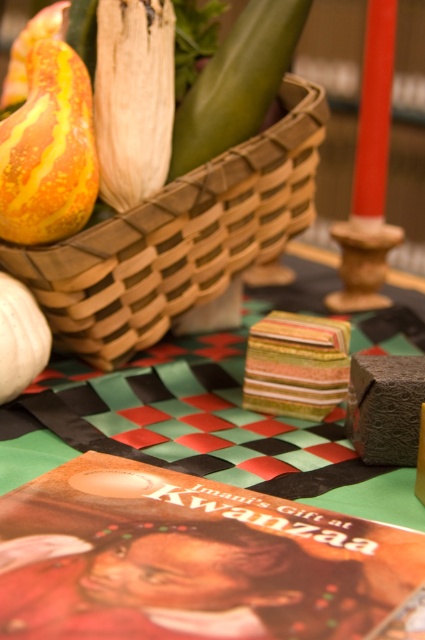
Question: Considering the relative positions of woven wood basket at upper left and yellow-orange striped gourd at upper left in the image provided, where is woven wood basket at upper left located with respect to yellow-orange striped gourd at upper left?

Choices:
 (A) below
 (B) above

Answer: (A)

Question: Which point is closer to the camera taking this photo?

Choices:
 (A) (218, 180)
 (B) (34, 328)
 (C) (258, 100)
 (D) (11, 131)

Answer: (D)

Question: Does striped paper napkin at center appear on the left side of green smooth vegetable at upper center?

Choices:
 (A) no
 (B) yes

Answer: (A)

Question: Estimate the real-world distances between objects in this image. Which object is closer to the green smooth vegetable at upper center?

Choices:
 (A) yellow-orange striped gourd at upper left
 (B) striped paper napkin at center
 (C) matte white pumpkin at lower left
 (D) woven wood basket at upper left

Answer: (D)

Question: Is striped paper napkin at center in front of yellow-orange striped gourd at upper left?

Choices:
 (A) yes
 (B) no

Answer: (A)

Question: Among these points, which one is farthest from the camera?

Choices:
 (A) (8, 317)
 (B) (17, 460)
 (C) (254, 33)
 (D) (10, 180)

Answer: (C)